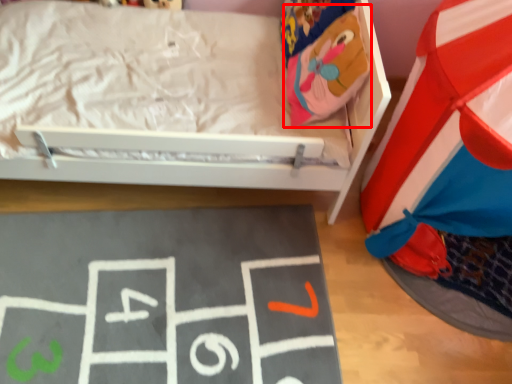
Question: From the image, what is the correct spatial relationship of bean bag chair (annotated by the red box) in relation to bulletin board?

Choices:
 (A) right
 (B) left

Answer: (A)